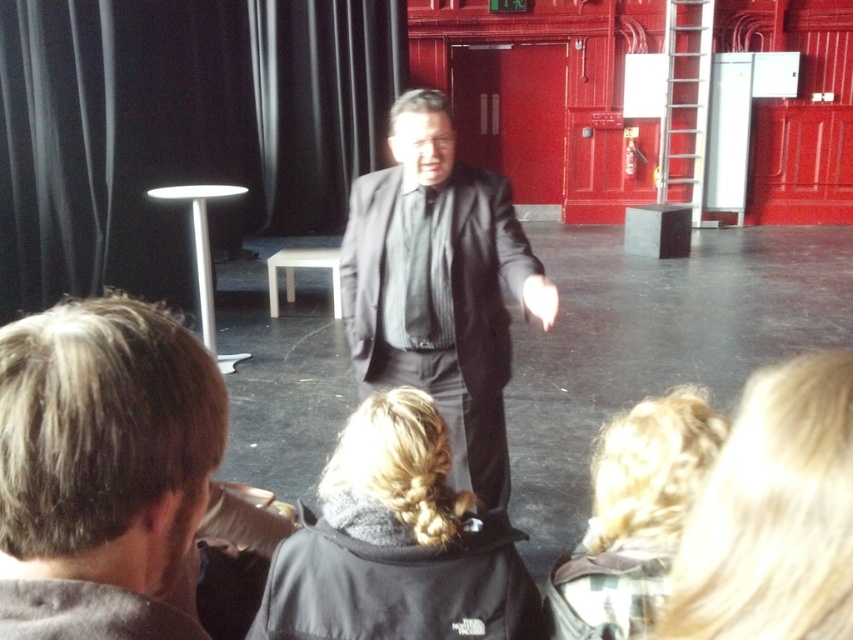
Is the position of black fabric curtain at upper left more distant than that of gray hair at lower left?

Yes, it is behind gray hair at lower left.

Is black fabric curtain at upper left thinner than gray hair at lower left?

No.

I want to click on black fabric curtain at upper left, so click(x=178, y=132).

Is point (135, 204) farther from viewer compared to point (492, 349)?

Yes, point (135, 204) is behind point (492, 349).

Does black fabric curtain at upper left have a greater width compared to matte black suit at center?

Yes, black fabric curtain at upper left is wider than matte black suit at center.

I want to click on black fabric curtain at upper left, so click(x=178, y=132).

Is black fabric jacket at lower center closer to the viewer compared to blonde hair at lower center?

No, it is behind blonde hair at lower center.

This screenshot has width=853, height=640. Describe the element at coordinates (397, 544) in the screenshot. I see `black fabric jacket at lower center` at that location.

Find the location of a particular element. The height and width of the screenshot is (640, 853). black fabric jacket at lower center is located at coordinates (397, 544).

Identify the location of black fabric jacket at lower center. The width and height of the screenshot is (853, 640). (397, 544).